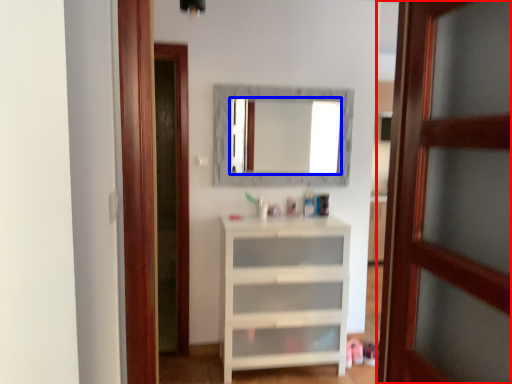
Question: Which object appears closest to the camera in this image, door (highlighted by a red box) or mirror (highlighted by a blue box)?

Choices:
 (A) door
 (B) mirror

Answer: (A)